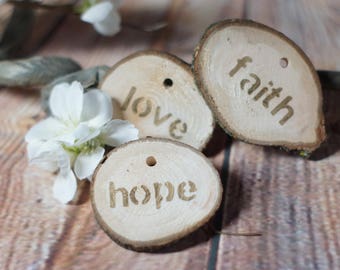
Locate an element on the screen. This screenshot has height=270, width=340. floor is located at coordinates 28,215.